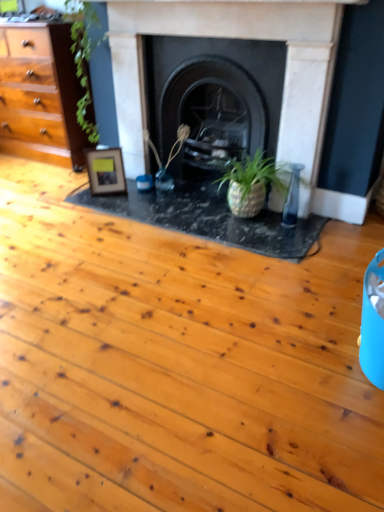
I want to click on vacant area that is in front of green matte plant at center, so click(165, 194).